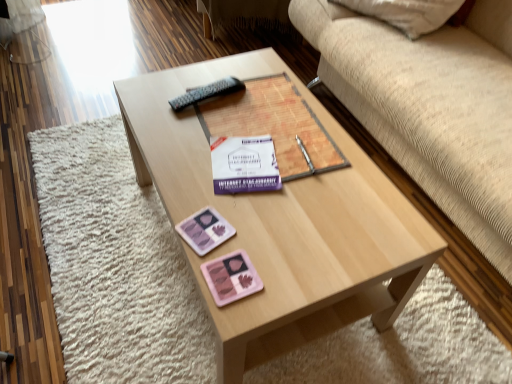
This screenshot has height=384, width=512. In order to click on free spot behind white paper at center in this screenshot , I will do `click(253, 125)`.